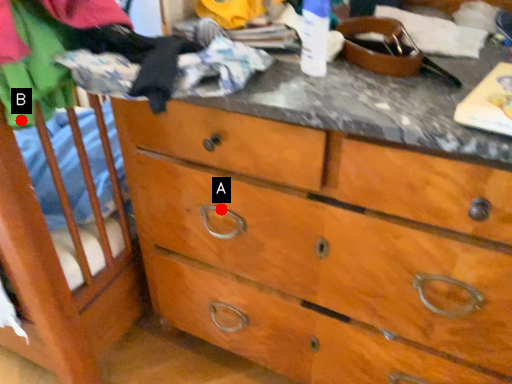
Question: Two points are circled on the image, labeled by A and B beside each circle. Which point appears farthest from the camera in this image?

Choices:
 (A) A is further
 (B) B is further

Answer: (A)